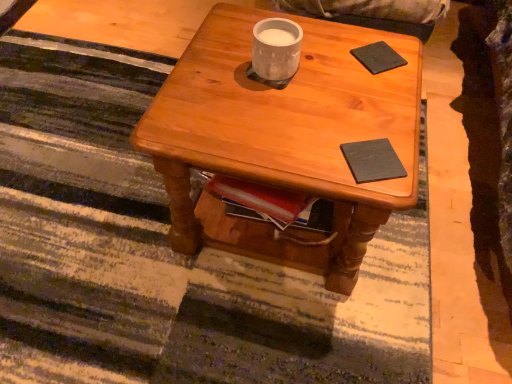
At what (x,y) coordinates should I click in order to perform the action: click on empty space that is in between white matte cup at center and black matte pad at upper right, placed as the second pad when sorted from bottom to top. Please return your answer as a coordinate pair (x, y). The height and width of the screenshot is (384, 512). Looking at the image, I should click on (330, 66).